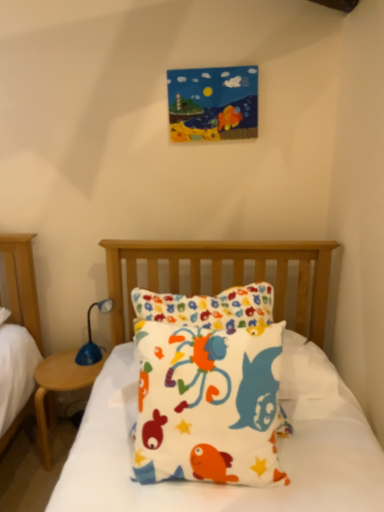
Identify the location of free space to the left of blue plastic table lamp at left. (60, 369).